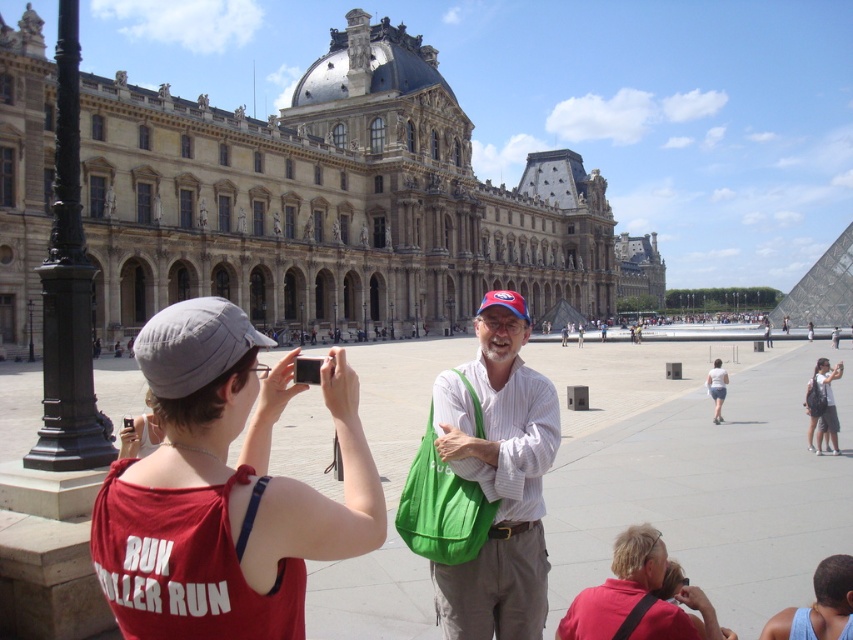
Does red cotton tank top at center have a larger size compared to matte white shirt at center?

Correct, red cotton tank top at center is larger in size than matte white shirt at center.

Is the position of red cotton tank top at center more distant than that of matte white shirt at center?

That is False.

Between point (206, 381) and point (523, 477), which one is positioned behind?

Positioned behind is point (523, 477).

I want to click on red cotton tank top at center, so click(x=224, y=488).

Is matte white shirt at center below white backpack at center?

Indeed, matte white shirt at center is positioned under white backpack at center.

Who is taller, matte white shirt at center or white backpack at center?

matte white shirt at center

Is point (462, 440) positioned in front of point (820, 397)?

Yes, it is.

The image size is (853, 640). I want to click on matte white shirt at center, so click(498, 477).

Can you confirm if matte white shirt at center is thinner than white cotton shorts at lower right?

Yes.

Which of these two, matte white shirt at center or white cotton shorts at lower right, stands shorter?

white cotton shorts at lower right is shorter.

Does point (544, 579) lie behind point (712, 380)?

No, (544, 579) is in front of (712, 380).

Where is `matte white shirt at center`? The height and width of the screenshot is (640, 853). matte white shirt at center is located at coordinates coord(498,477).